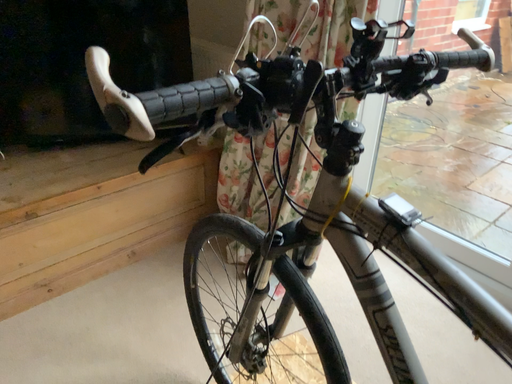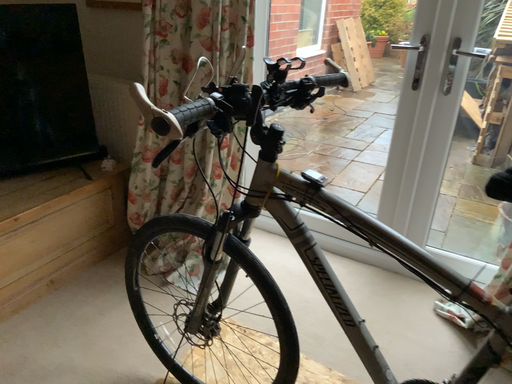
Question: How did the camera likely rotate when shooting the video?

Choices:
 (A) rotated left
 (B) rotated right

Answer: (B)